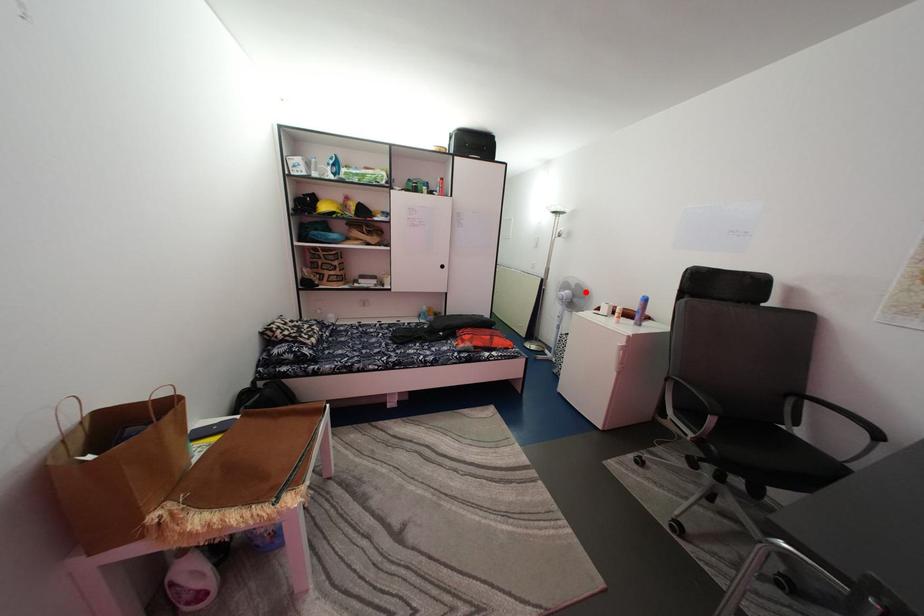
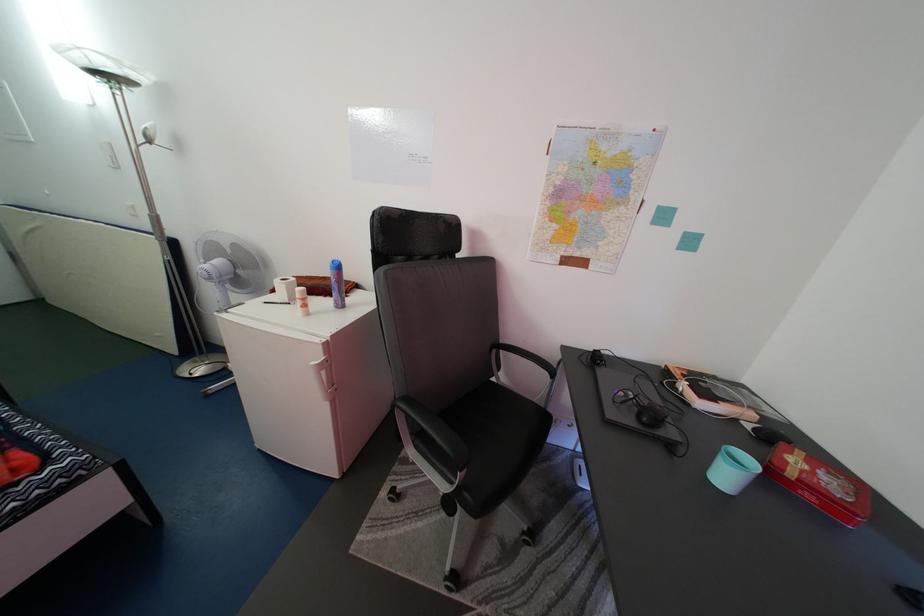
In the second image, find the point that corresponds to the highlighted location in the first image.

(244, 253)